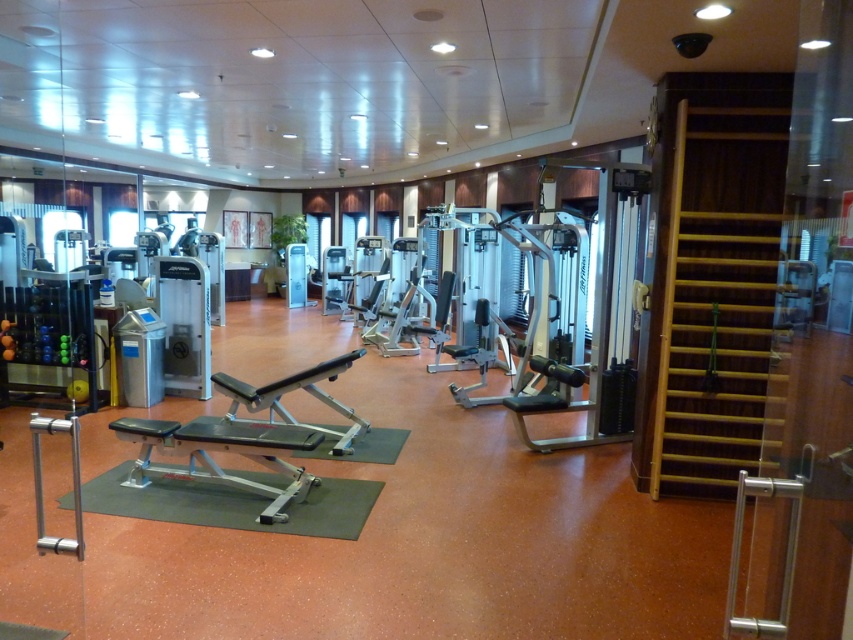
Can you confirm if silver metallic bench at center is wider than green rubber mat at center?

No.

Does silver metallic bench at center appear on the right side of green rubber mat at center?

Incorrect, silver metallic bench at center is not on the right side of green rubber mat at center.

Locate an element on the screen. The width and height of the screenshot is (853, 640). silver metallic bench at center is located at coordinates (245, 436).

Identify the location of silver metallic bench at center. The image size is (853, 640). (245, 436).